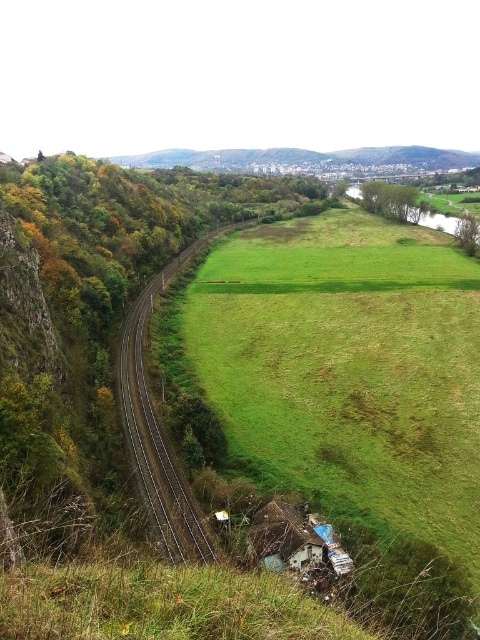
Between green grassy field at center and metallic tracks at center, which one has more height?

Standing taller between the two is green grassy field at center.

Does point (290, 454) come in front of point (195, 504)?

No.

Locate an element on the screen. The width and height of the screenshot is (480, 640). green grassy field at center is located at coordinates (348, 371).